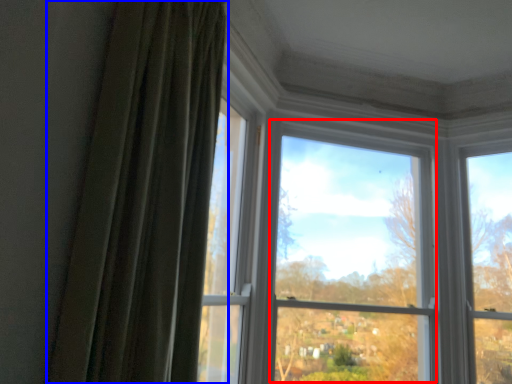
Question: Which object appears farthest to the camera in this image, bay window (highlighted by a red box) or curtain (highlighted by a blue box)?

Choices:
 (A) bay window
 (B) curtain

Answer: (A)